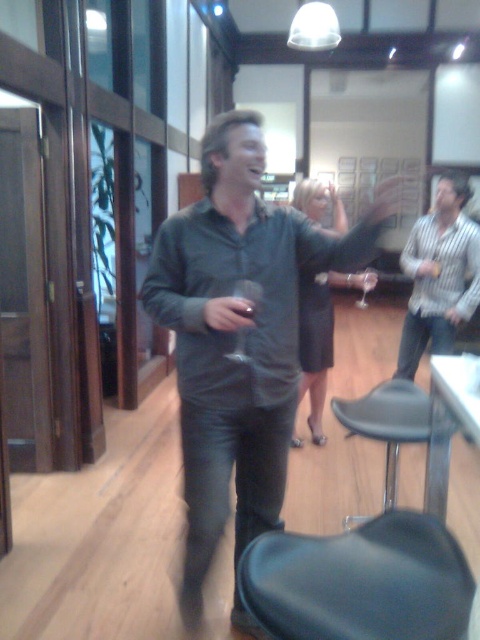
Question: Which of these objects is positioned farthest from the transparent glass at center?

Choices:
 (A) striped cotton shirt at upper right
 (B) matte gray shirt at center

Answer: (B)

Question: Estimate the real-world distances between objects in this image. Which object is closer to the black leather bar stool at lower right?

Choices:
 (A) transparent glass at center
 (B) striped cotton shirt at upper right
 (C) transparent plastic wine glass at center
 (D) striped shirt at right

Answer: (C)

Question: Which of the following is the farthest from the observer?

Choices:
 (A) (418, 432)
 (B) (362, 305)
 (C) (184, 371)

Answer: (B)

Question: Is striped shirt at right to the left of black leather bar stool at lower right from the viewer's perspective?

Choices:
 (A) no
 (B) yes

Answer: (A)

Question: Is striped shirt at right above transparent plastic wine glass at center?

Choices:
 (A) yes
 (B) no

Answer: (A)

Question: Can you confirm if striped shirt at right is smaller than transparent plastic wine glass at center?

Choices:
 (A) no
 (B) yes

Answer: (A)